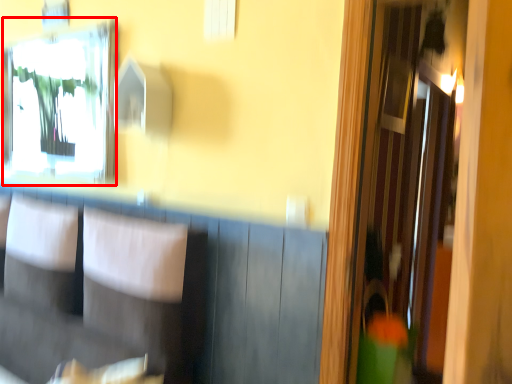
Question: In this image, where is mirror (annotated by the red box) located relative to armchair?

Choices:
 (A) right
 (B) left

Answer: (B)